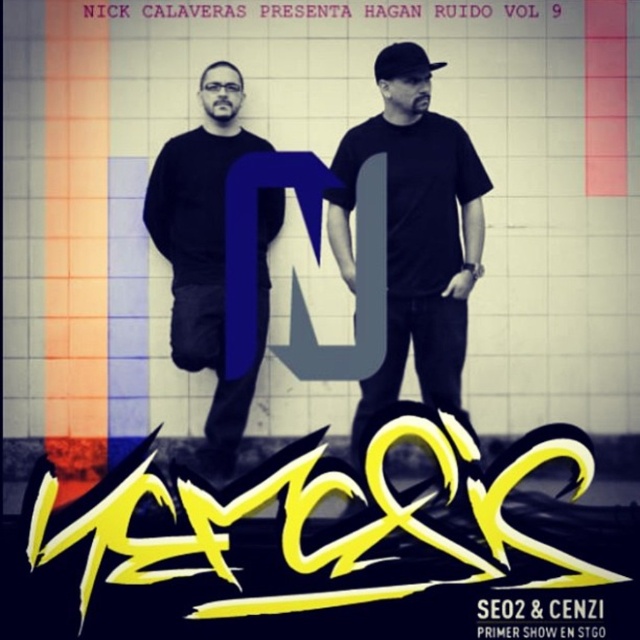
Who is positioned more to the right, black matte t-shirt at center or white paper text at upper center?

black matte t-shirt at center is more to the right.

How much distance is there between black matte t-shirt at center and white paper text at upper center?

black matte t-shirt at center is 29.61 inches away from white paper text at upper center.

Is point (417, 288) positioned behind point (204, 10)?

Yes.

Image resolution: width=640 pixels, height=640 pixels. I want to click on black matte t-shirt at center, so click(416, 243).

Is white paper text at upper center positioned at the back of black matte baseball cap at upper center?

That is True.

Is the position of white paper text at upper center less distant than that of black matte baseball cap at upper center?

That is False.

Which is behind, point (412, 12) or point (387, 45)?

Positioned behind is point (412, 12).

You are a GUI agent. You are given a task and a screenshot of the screen. Output one action in this format:
    pyautogui.click(x=<x>, y=<y>)
    Task: Click on the white paper text at upper center
    The width and height of the screenshot is (640, 640).
    Given the screenshot: What is the action you would take?
    pyautogui.click(x=193, y=10)

Is black matte t-shirt at center to the left of black matte shirt at center from the viewer's perspective?

In fact, black matte t-shirt at center is to the right of black matte shirt at center.

Can you confirm if black matte t-shirt at center is bigger than black matte shirt at center?

Yes, black matte t-shirt at center is bigger than black matte shirt at center.

Is point (404, 284) positioned after point (228, 424)?

Yes, point (404, 284) is farther from viewer.

You are a GUI agent. You are given a task and a screenshot of the screen. Output one action in this format:
    pyautogui.click(x=<x>, y=<y>)
    Task: Click on the black matte t-shirt at center
    
    Given the screenshot: What is the action you would take?
    pyautogui.click(x=416, y=243)